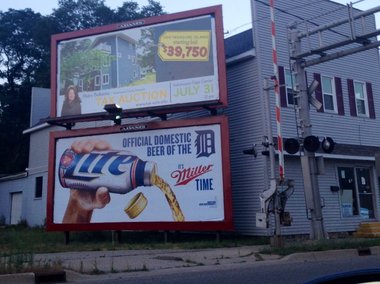
You are a GUI agent. You are given a task and a screenshot of the screen. Output one action in this format:
    pyautogui.click(x=<x>, y=<y>)
    Task: Click on the window
    This screenshot has width=380, height=284.
    Given the screenshot: What is the action you would take?
    pyautogui.click(x=330, y=94)